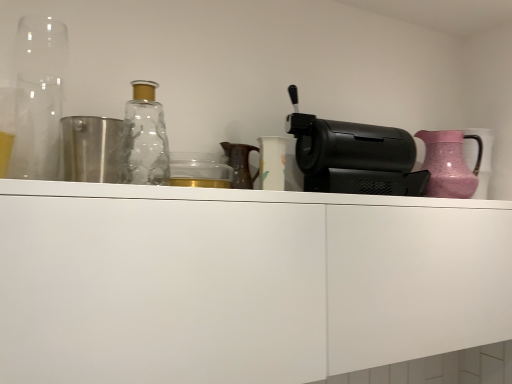
Question: From a real-world perspective, is transparent glass at left positioned above or below white matte cabinet at center?

Choices:
 (A) above
 (B) below

Answer: (A)

Question: From their relative heights in the image, would you say transparent glass at left is taller or shorter than white matte cabinet at center?

Choices:
 (A) short
 (B) tall

Answer: (A)

Question: Which is nearer to the black plastic coffee machine at right?

Choices:
 (A) transparent glass at left
 (B) transparent glass bottle at upper left
 (C) pink textured jug at right
 (D) white matte cabinet at center

Answer: (C)

Question: Which object is positioned farthest from the black plastic coffee machine at right?

Choices:
 (A) transparent glass bottle at upper left
 (B) white matte cabinet at center
 (C) transparent glass at left
 (D) pink textured jug at right

Answer: (C)